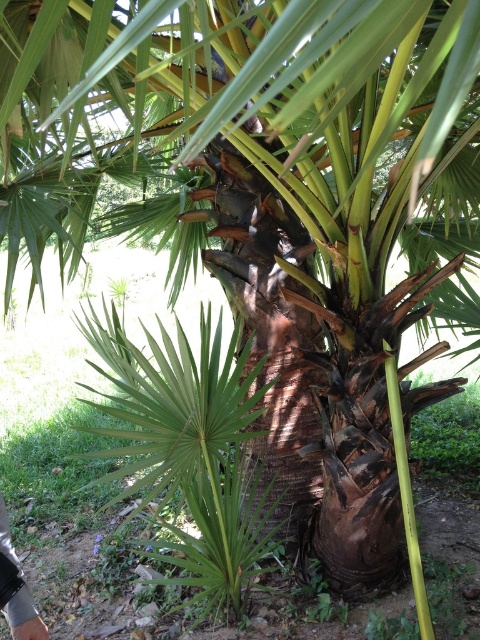
The image size is (480, 640). Describe the element at coordinates (19, 593) in the screenshot. I see `metallic silver glove at lower left` at that location.

Does point (22, 609) come farther from viewer compared to point (41, 627)?

No, (22, 609) is in front of (41, 627).

Measure the distance between metallic silver glove at lower left and camera.

1.18 meters

At what (x,y) coordinates should I click in order to perform the action: click on metallic silver glove at lower left. Please return your answer as a coordinate pair (x, y). The image size is (480, 640). Looking at the image, I should click on coord(19,593).